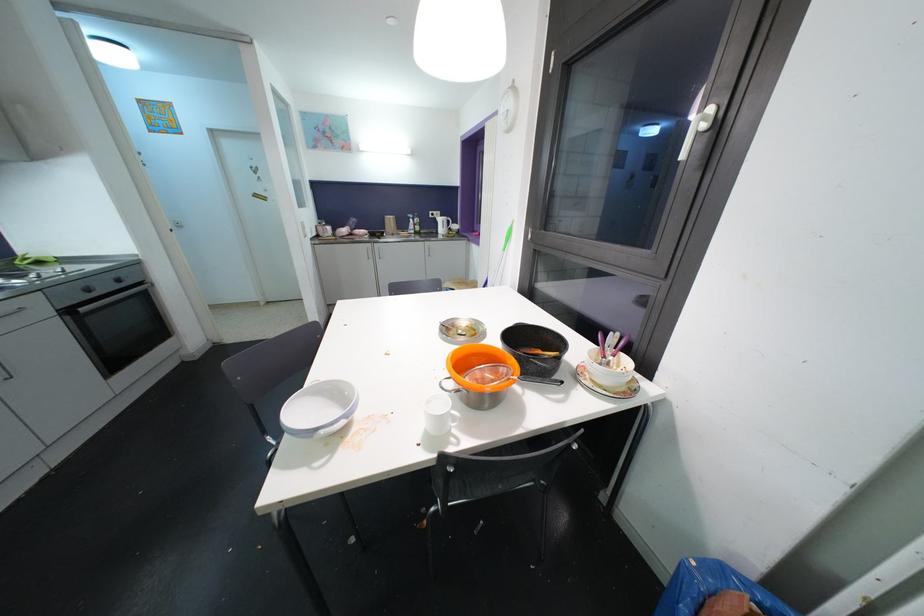
What does the point at ([445,384] refer to?

It corresponds to the silver pot handle in the image.